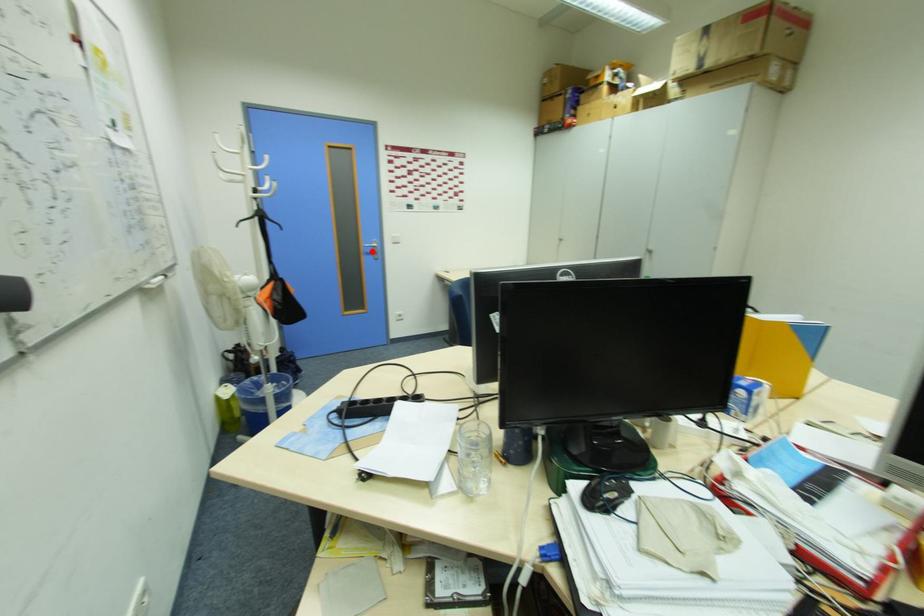
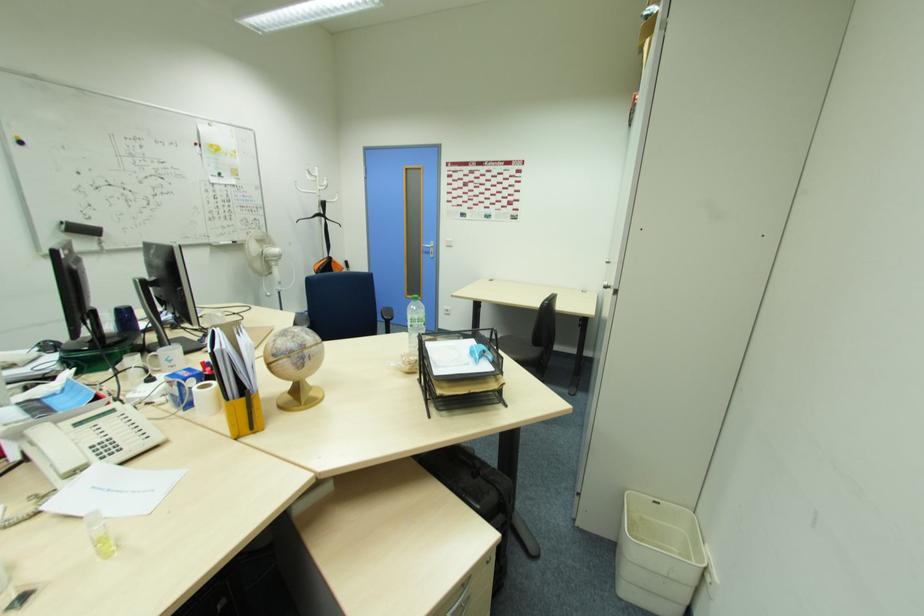
Where in the second image is the point corresponding to the highlighted location from the first image?

(430, 252)